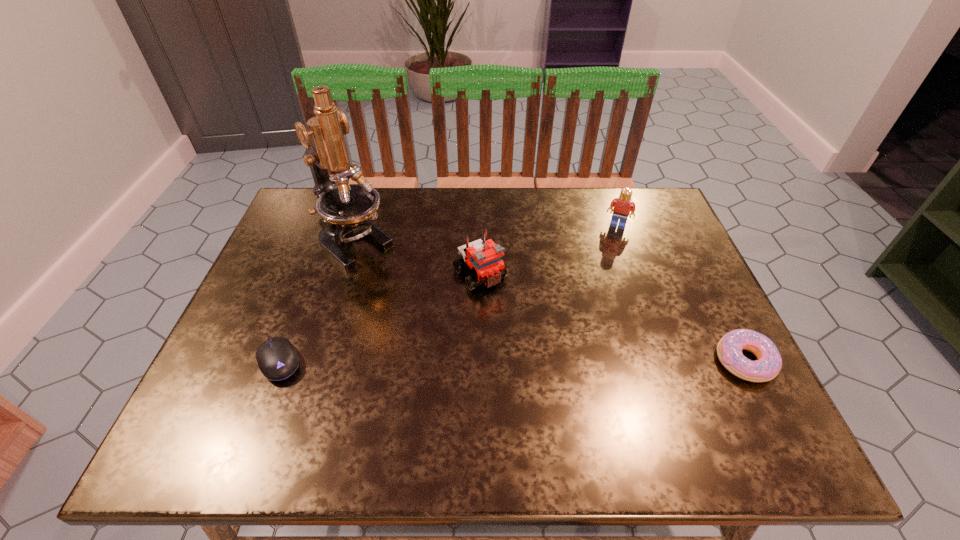
The image size is (960, 540). I want to click on unoccupied area between the computer mouse and the farther Lego, so click(448, 293).

Locate an element on the screen. The image size is (960, 540). free space between the shortest object and the left Lego is located at coordinates (379, 318).

Locate an element on the screen. The width and height of the screenshot is (960, 540). blank region between the left Lego and the shortest object is located at coordinates (379, 318).

Where is `empty space that is in between the right Lego and the doughnut`? This screenshot has width=960, height=540. empty space that is in between the right Lego and the doughnut is located at coordinates (681, 293).

Find the location of a particular element. free space between the farther Lego and the doughnut is located at coordinates (681, 293).

Image resolution: width=960 pixels, height=540 pixels. Find the location of `empty location between the computer mouse and the microscope`. empty location between the computer mouse and the microscope is located at coordinates (316, 302).

The height and width of the screenshot is (540, 960). I want to click on object identified as the second closest to the computer mouse, so click(484, 257).

At what (x,y) coordinates should I click in order to perform the action: click on the closest object to the left Lego. Please return your answer as a coordinate pair (x, y). This screenshot has width=960, height=540. Looking at the image, I should click on (344, 208).

This screenshot has height=540, width=960. Identify the location of vacant space that satisfies the following two spatial constraints: 1. on the front side of the doughnut; 2. on the left side of the farther Lego. pyautogui.click(x=666, y=361).

Find the location of a particular element. The height and width of the screenshot is (540, 960). free spot that satisfies the following two spatial constraints: 1. on the front side of the microscope; 2. on the left side of the third object from right to left is located at coordinates (343, 274).